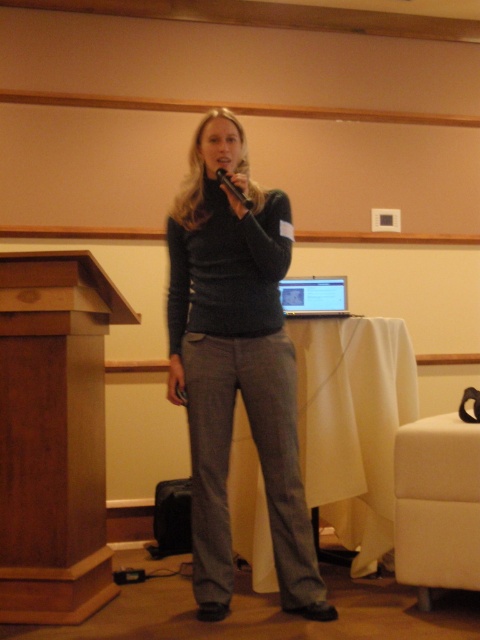
From the picture: You are a stagehand who needs to move the black matte microphone at center closer to the wooden podium at left. The stage is narrow, and you can only move the microphone 1 meter towards the podium. Will the microphone be able to reach the podium after moving it?

The distance between wooden podium at left and black matte microphone at center is 1.14 meters. Moving the microphone 1 meter towards the podium would leave a remaining distance of 0.14 meters between them. Therefore, the microphone will not reach the podium.

You are an attendee at this event and want to sit down. You see the white fabric armchair at lower right and the silver metallic laptop at center. Which object is located to the right side of the other?

The white fabric armchair at lower right is to the right of the silver metallic laptop at center.